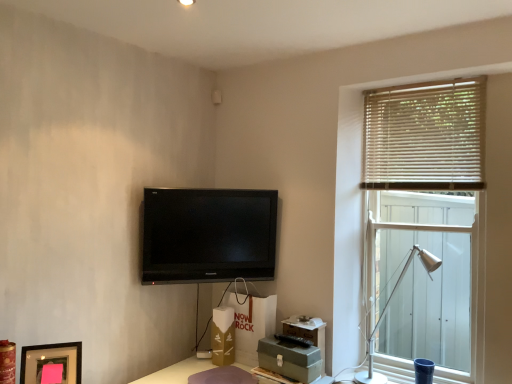
The width and height of the screenshot is (512, 384). What do you see at coordinates (208, 235) in the screenshot?
I see `black glossy tv at upper center` at bounding box center [208, 235].

This screenshot has width=512, height=384. What do you see at coordinates (51, 361) in the screenshot?
I see `matte black picture frame at lower left` at bounding box center [51, 361].

Describe the element at coordinates (386, 309) in the screenshot. I see `silver metallic table lamp at right` at that location.

Locate an element on the screen. matte brown table at lower center is located at coordinates (177, 371).

Where is `black glossy tv at upper center`? Image resolution: width=512 pixels, height=384 pixels. black glossy tv at upper center is located at coordinates click(x=208, y=235).

In the scene shown: In terms of width, does matte black picture frame at lower left look wider or thinner when compared to wooden blinds at right?

Considering their sizes, matte black picture frame at lower left looks slimmer than wooden blinds at right.

Does point (23, 361) come closer to viewer compared to point (416, 294)?

That is True.

Would you say matte black picture frame at lower left is a long distance from wooden blinds at right?

That's right, there is a large distance between matte black picture frame at lower left and wooden blinds at right.

Based on their positions, is matte black picture frame at lower left located to the left or right of wooden blinds at right?

Based on their positions, matte black picture frame at lower left is located to the left of wooden blinds at right.

Which of these two, matte brown table at lower center or beige wooden blinds at upper right, is wider?

matte brown table at lower center.

There is a matte brown table at lower center. Where is `window blind above it (from a real-world perspective)`? Image resolution: width=512 pixels, height=384 pixels. window blind above it (from a real-world perspective) is located at coordinates (425, 136).

Does wooden blinds at right have a greater height compared to beige wooden blinds at upper right?

Yes.

Is wooden blinds at right completely or partially outside of beige wooden blinds at upper right?

wooden blinds at right is positioned outside beige wooden blinds at upper right.

From the image's perspective, which one is positioned lower, wooden blinds at right or beige wooden blinds at upper right?

wooden blinds at right, from the image's perspective.

Does wooden blinds at right come in front of beige wooden blinds at upper right?

That is True.

Considering the relative positions of black glossy tv at upper center and silver metallic table lamp at right in the image provided, is black glossy tv at upper center to the right of silver metallic table lamp at right from the viewer's perspective?

No, black glossy tv at upper center is not to the right of silver metallic table lamp at right.

Can you confirm if black glossy tv at upper center is wider than silver metallic table lamp at right?

In fact, black glossy tv at upper center might be narrower than silver metallic table lamp at right.

Is black glossy tv at upper center not within silver metallic table lamp at right?

Yes, black glossy tv at upper center is not within silver metallic table lamp at right.

From the image's perspective, who appears lower, matte black picture frame at lower left or silver metallic table lamp at right?

matte black picture frame at lower left is shown below in the image.

Could you tell me if matte black picture frame at lower left is facing silver metallic table lamp at right?

No, matte black picture frame at lower left does not turn towards silver metallic table lamp at right.

Is matte black picture frame at lower left wider or thinner than silver metallic table lamp at right?

matte black picture frame at lower left is thinner than silver metallic table lamp at right.

From a real-world perspective, is matte black picture frame at lower left physically located above or below silver metallic table lamp at right?

matte black picture frame at lower left is situated lower than silver metallic table lamp at right in the real world.

Are black glossy tv at upper center and beige wooden blinds at upper right far apart?

black glossy tv at upper center is near beige wooden blinds at upper right, not far away.

Is black glossy tv at upper center oriented towards beige wooden blinds at upper right?

No, black glossy tv at upper center is not turned towards beige wooden blinds at upper right.

Considering the sizes of objects black glossy tv at upper center and beige wooden blinds at upper right in the image provided, who is smaller, black glossy tv at upper center or beige wooden blinds at upper right?

Smaller between the two is beige wooden blinds at upper right.

Where is `window blind lying on the right of black glossy tv at upper center`? The width and height of the screenshot is (512, 384). window blind lying on the right of black glossy tv at upper center is located at coordinates (425, 136).

From the image's perspective, is beige wooden blinds at upper right above or below matte black picture frame at lower left?

Based on their image positions, beige wooden blinds at upper right is located above matte black picture frame at lower left.

From the picture: Can you confirm if beige wooden blinds at upper right is positioned to the left of matte black picture frame at lower left?

No, beige wooden blinds at upper right is not to the left of matte black picture frame at lower left.

Can you tell me how much beige wooden blinds at upper right and matte black picture frame at lower left differ in facing direction?

They differ by 53.3 degrees in their facing directions.

Based on the photo, is matte black picture frame at lower left at the back of beige wooden blinds at upper right?

No, matte black picture frame at lower left is not at the back of beige wooden blinds at upper right.

You are a GUI agent. You are given a task and a screenshot of the screen. Output one action in this format:
    pyautogui.click(x=<x>, y=<y>)
    Task: Click on the picture frame in front of the wooden blinds at right
    This screenshot has height=384, width=512.
    Given the screenshot: What is the action you would take?
    pyautogui.click(x=51, y=361)

At what (x,y) coordinates should I click in order to perform the action: click on table below the beige wooden blinds at upper right (from the image's perspective). Please return your answer as a coordinate pair (x, y). The height and width of the screenshot is (384, 512). Looking at the image, I should click on (177, 371).

From the image, which object appears to be nearer to wooden blinds at right, black glossy tv at upper center or silver metallic table lamp at right?

Based on the image, silver metallic table lamp at right appears to be nearer to wooden blinds at right.

Looking at the image, which one is located further to beige wooden blinds at upper right, matte brown table at lower center or matte black picture frame at lower left?

matte black picture frame at lower left.

Considering their positions, is wooden blinds at right positioned closer to silver metallic table lamp at right than matte brown table at lower center?

wooden blinds at right is closer to silver metallic table lamp at right.

Considering their positions, is matte brown table at lower center positioned further to matte black picture frame at lower left than wooden blinds at right?

wooden blinds at right is further to matte black picture frame at lower left.

From the image, which object appears to be nearer to matte black picture frame at lower left, silver metallic table lamp at right or matte brown table at lower center?

matte brown table at lower center is closer to matte black picture frame at lower left.

Based on their spatial positions, is black glossy tv at upper center or beige wooden blinds at upper right closer to silver metallic table lamp at right?

Among the two, beige wooden blinds at upper right is located nearer to silver metallic table lamp at right.

Based on their spatial positions, is matte brown table at lower center or wooden blinds at right closer to black glossy tv at upper center?

matte brown table at lower center is positioned closer to the anchor black glossy tv at upper center.

Which object lies further to the anchor point matte brown table at lower center, wooden blinds at right or beige wooden blinds at upper right?

beige wooden blinds at upper right lies further to matte brown table at lower center than the other object.

At what (x,y) coordinates should I click in order to perform the action: click on window between beige wooden blinds at upper right and silver metallic table lamp at right from top to bottom. Please return your answer as a coordinate pair (x, y). Image resolution: width=512 pixels, height=384 pixels. Looking at the image, I should click on (423, 225).

You are a GUI agent. You are given a task and a screenshot of the screen. Output one action in this format:
    pyautogui.click(x=<x>, y=<y>)
    Task: Click on the table lamp situated between black glossy tv at upper center and wooden blinds at right from left to right
    Image resolution: width=512 pixels, height=384 pixels.
    Given the screenshot: What is the action you would take?
    [386, 309]

This screenshot has height=384, width=512. I want to click on table lamp between beige wooden blinds at upper right and matte brown table at lower center in the up-down direction, so click(386, 309).

You are a GUI agent. You are given a task and a screenshot of the screen. Output one action in this format:
    pyautogui.click(x=<x>, y=<y>)
    Task: Click on the television between beige wooden blinds at upper right and matte brown table at lower center from top to bottom
    This screenshot has width=512, height=384.
    Given the screenshot: What is the action you would take?
    pyautogui.click(x=208, y=235)